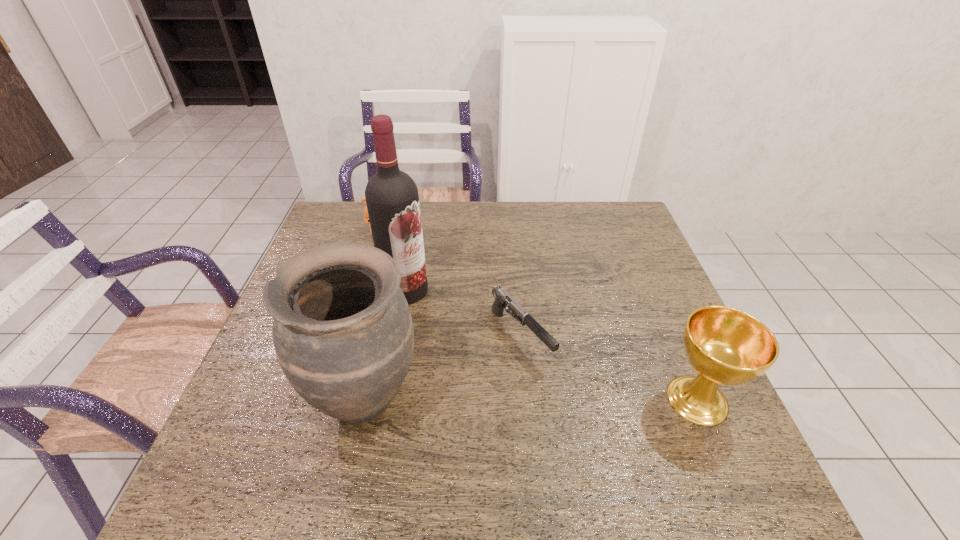
Identify the location of free spot on the desktop that is between the second tallest object and the chalice and is positioned on the label of the fourth nearest object. (511, 400).

At what (x,y) coordinates should I click in order to perform the action: click on vacant space on the desktop that is between the fourth shortest object and the rightmost object and is positioned on the face of the second shortest object. Please return your answer as a coordinate pair (x, y). The height and width of the screenshot is (540, 960). Looking at the image, I should click on (563, 400).

In order to click on free space on the desktop that is between the second tallest object and the rightmost object and is positioned at the muzzle end of the shortest object in this screenshot , I will do `click(581, 400)`.